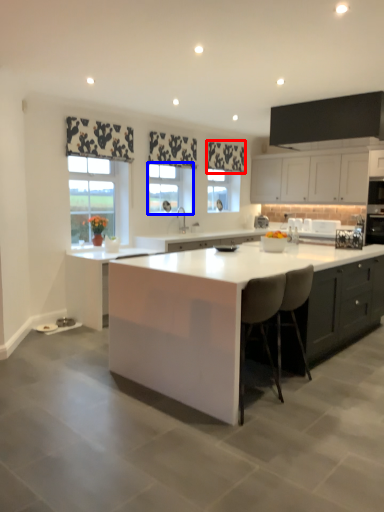
Question: Which point is further to the camera, curtain (highlighted by a red box) or window (highlighted by a blue box)?

Choices:
 (A) curtain
 (B) window

Answer: (A)